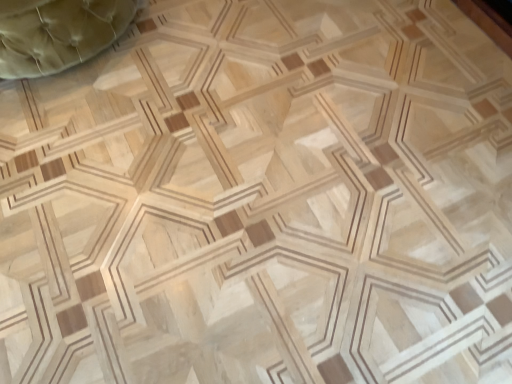
This screenshot has width=512, height=384. Describe the element at coordinates (57, 33) in the screenshot. I see `green suede bean bag at upper left` at that location.

Locate an element on the screen. green suede bean bag at upper left is located at coordinates (57, 33).

Locate an element on the screen. green suede bean bag at upper left is located at coordinates (57, 33).